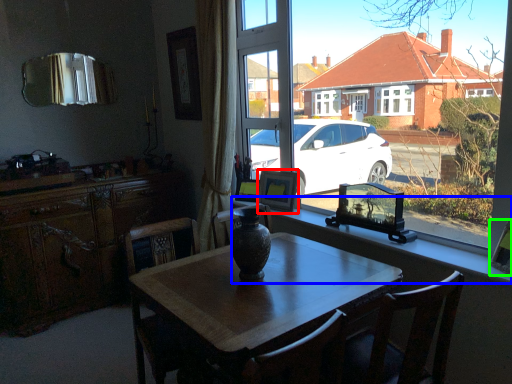
Question: Considering the real-world distances, which object is closest to picture frame (highlighted by a red box)? window sill (highlighted by a blue box) or picture frame (highlighted by a green box).

Choices:
 (A) window sill
 (B) picture frame

Answer: (A)